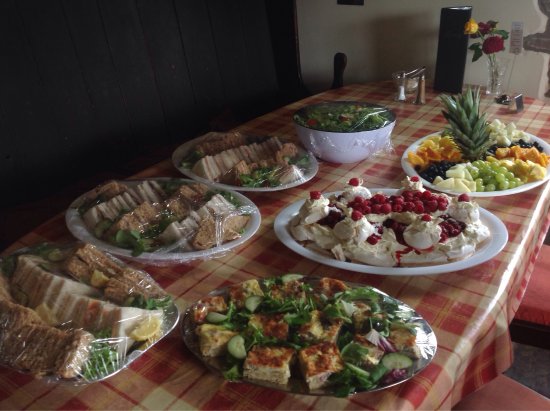
This screenshot has width=550, height=411. I want to click on salt shaker, so click(404, 95).